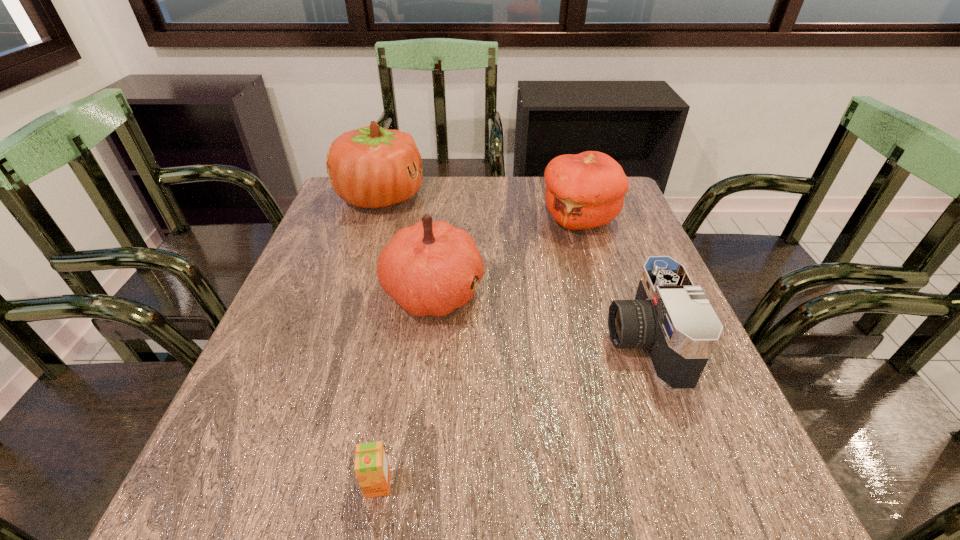
Where is `free spot that satisfies the following two spatial constraints: 1. on the front-facing side of the camera; 2. on the front side of the shortest object`? This screenshot has height=540, width=960. free spot that satisfies the following two spatial constraints: 1. on the front-facing side of the camera; 2. on the front side of the shortest object is located at coordinates (698, 484).